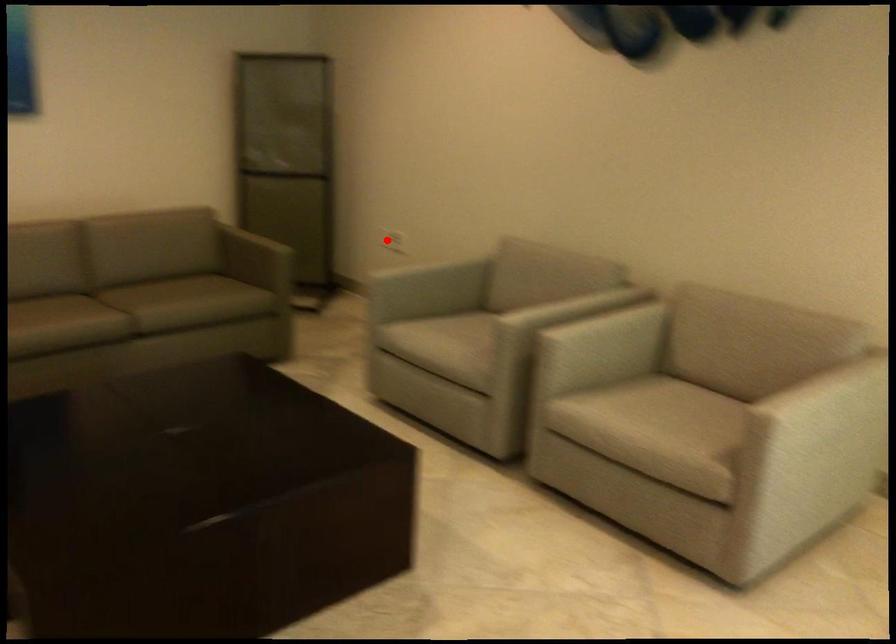
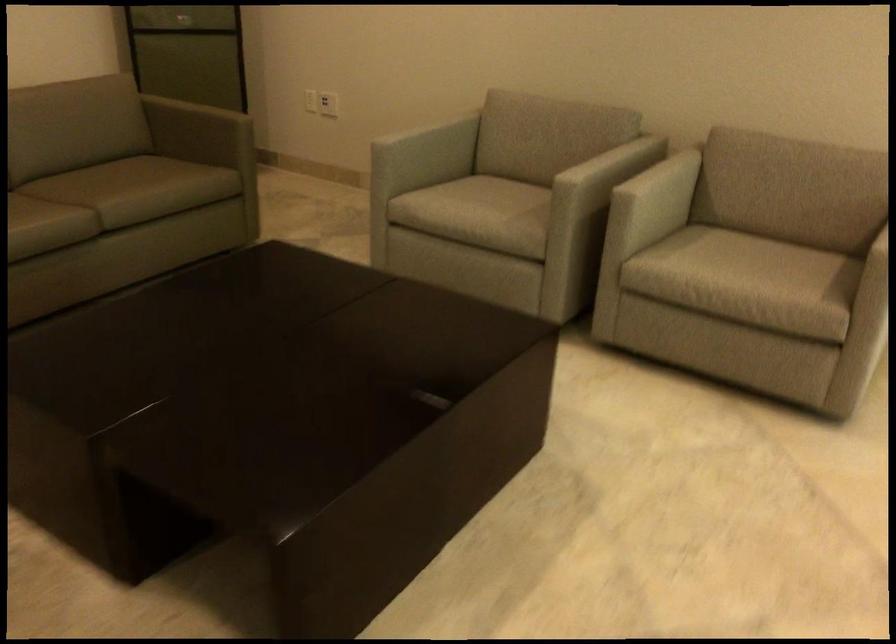
Question: I am providing you with two images of the same scene from different viewpoints. A red point is marked on the first image. Is the red point's position out of view in image 2?

Choices:
 (A) Yes
 (B) No

Answer: (B)